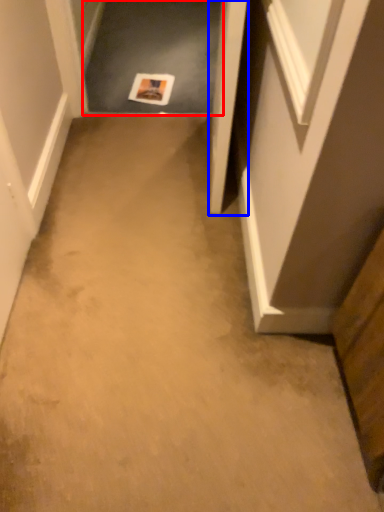
Question: Among these objects, which one is nearest to the camera, passage (highlighted by a red box) or door (highlighted by a blue box)?

Choices:
 (A) passage
 (B) door

Answer: (B)